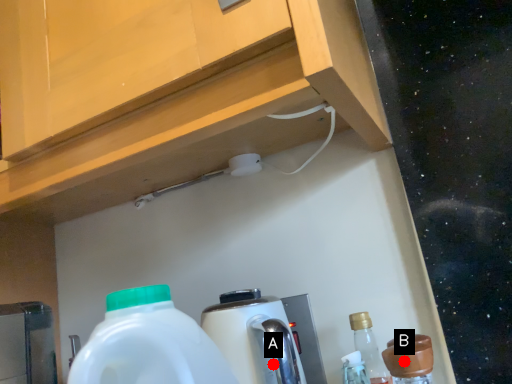
Question: Two points are circled on the image, labeled by A and B beside each circle. Which point is farther to the camera?

Choices:
 (A) A is further
 (B) B is further

Answer: (A)